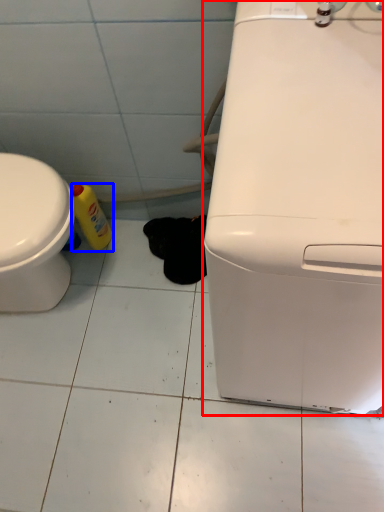
Question: Which object is further to the camera taking this photo, home appliance (highlighted by a red box) or bottle (highlighted by a blue box)?

Choices:
 (A) home appliance
 (B) bottle

Answer: (B)